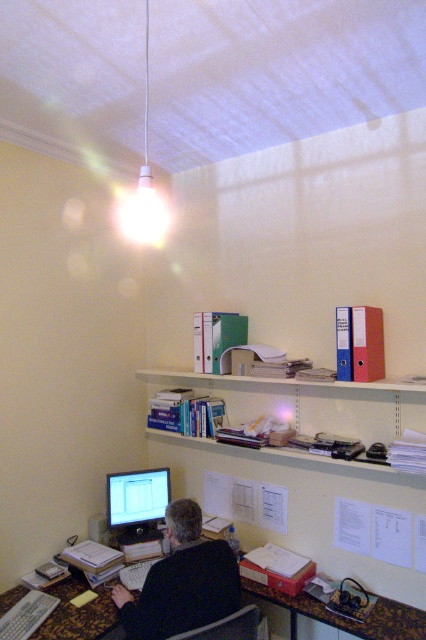
You are setting up a desk in this home office and need to place the matte black monitor at lower center under a light source. Is the white matte lamp at upper center positioned above it to provide adequate lighting?

Yes, the matte black monitor at lower center is positioned under the white matte lamp at upper center, so the lamp is above it and can provide adequate lighting.